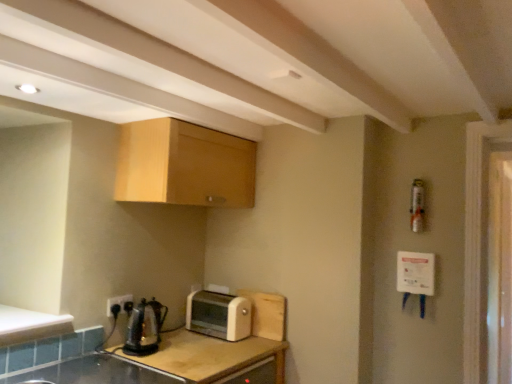
Question: Can you confirm if white matte counter top at lower left is wider than beige plastic toaster at center?

Choices:
 (A) no
 (B) yes

Answer: (B)

Question: Does white matte counter top at lower left have a larger size compared to beige plastic toaster at center?

Choices:
 (A) no
 (B) yes

Answer: (A)

Question: Is white matte counter top at lower left thinner than beige plastic toaster at center?

Choices:
 (A) yes
 (B) no

Answer: (B)

Question: Does white matte counter top at lower left have a lesser height compared to beige plastic toaster at center?

Choices:
 (A) no
 (B) yes

Answer: (B)

Question: Does white matte counter top at lower left lie in front of beige plastic toaster at center?

Choices:
 (A) yes
 (B) no

Answer: (A)

Question: Is white matte counter top at lower left taller than beige plastic toaster at center?

Choices:
 (A) no
 (B) yes

Answer: (A)

Question: Is transparent glass screen door at right directly adjacent to white matte counter top at lower left?

Choices:
 (A) no
 (B) yes

Answer: (A)

Question: Is transparent glass screen door at right not near white matte counter top at lower left?

Choices:
 (A) yes
 (B) no

Answer: (A)

Question: Is transparent glass screen door at right to the left of white matte counter top at lower left from the viewer's perspective?

Choices:
 (A) yes
 (B) no

Answer: (B)

Question: Can you confirm if transparent glass screen door at right is smaller than white matte counter top at lower left?

Choices:
 (A) yes
 (B) no

Answer: (B)

Question: Is transparent glass screen door at right facing away from white matte counter top at lower left?

Choices:
 (A) yes
 (B) no

Answer: (B)

Question: Is transparent glass screen door at right taller than white matte counter top at lower left?

Choices:
 (A) no
 (B) yes

Answer: (B)

Question: Is transparent glass screen door at right positioned beyond the bounds of beige plastic toaster at center?

Choices:
 (A) no
 (B) yes

Answer: (B)